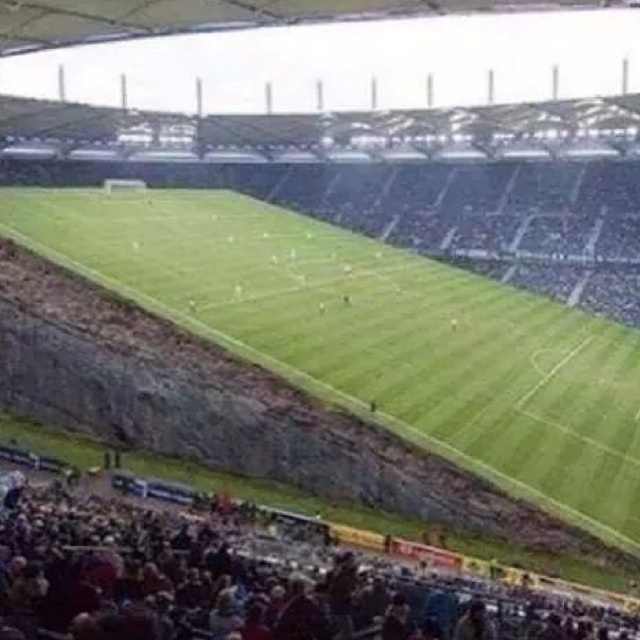
Can you confirm if green grass football field at center is shorter than dark brown leather seats at lower left?

Incorrect, green grass football field at center's height does not fall short of dark brown leather seats at lower left's.

Between green grass football field at center and dark brown leather seats at lower left, which one appears on the left side from the viewer's perspective?

From the viewer's perspective, dark brown leather seats at lower left appears more on the left side.

What do you see at coordinates (371, 330) in the screenshot? This screenshot has width=640, height=640. I see `green grass football field at center` at bounding box center [371, 330].

Identify the location of green grass football field at center. This screenshot has width=640, height=640. (371, 330).